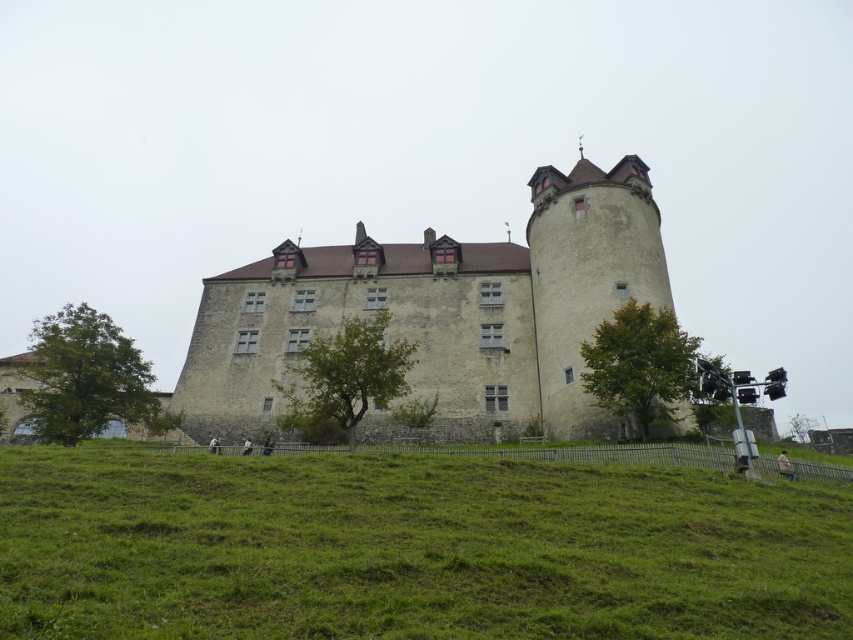
Question: Is stone castle at center wider than stone tower at right?

Choices:
 (A) no
 (B) yes

Answer: (B)

Question: Which is farther from the stone tower at right?

Choices:
 (A) stone castle at center
 (B) green grassy hillside at lower center

Answer: (B)

Question: Can you confirm if green grassy hillside at lower center is smaller than stone castle at center?

Choices:
 (A) yes
 (B) no

Answer: (A)

Question: Which point appears closest to the camera in this image?

Choices:
 (A) (606, 262)
 (B) (576, 269)

Answer: (A)

Question: Based on their relative distances, which object is farther from the stone tower at right?

Choices:
 (A) stone castle at center
 (B) green grassy hillside at lower center

Answer: (B)

Question: Does green grassy hillside at lower center appear on the left side of stone castle at center?

Choices:
 (A) yes
 (B) no

Answer: (A)